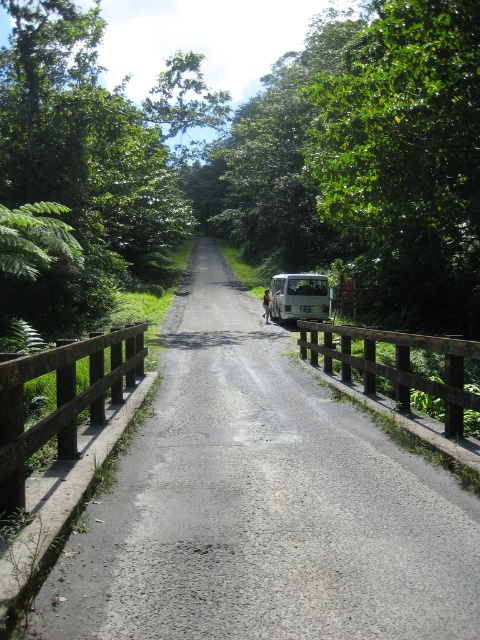
You are a delivery driver who needs to turn around your van on the road. Considering the space available, can you safely maneuver the van on the smooth concrete road at center without hitting the green leafy tree at upper right?

The smooth concrete road at center occupies less space than the green leafy tree at upper right, so there might not be enough space to safely maneuver the van without hitting the tree.

You are a hiker who has just arrived at the green leafy tree at center. You want to take a photo of the white van parked on the right side of the road. Your camera has a maximum zoom range of 15 meters. Can you capture the white van parked on the right side of the road with your camera?

The green leafy tree at center and camera are 15.49 meters apart from each other. Since the maximum zoom range is 15 meters, the distance is slightly beyond the camera capability. Therefore, you cannot capture the white van parked on the right side of the road with your camera.

You are driving a car and need to park on the narrow road. There are two points marked on the road where you can park. The first point is at coordinates point [169,179] and the second is at point [279,284]. Which parking spot is closer to you as you approach the road?

The point [169,179] is closer to you because it is further to the viewer than point [279,284].